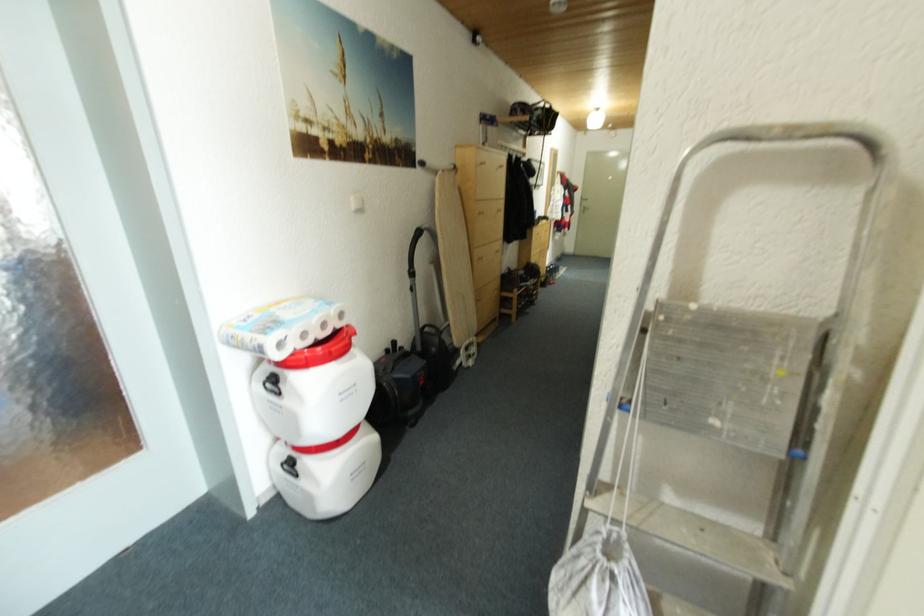
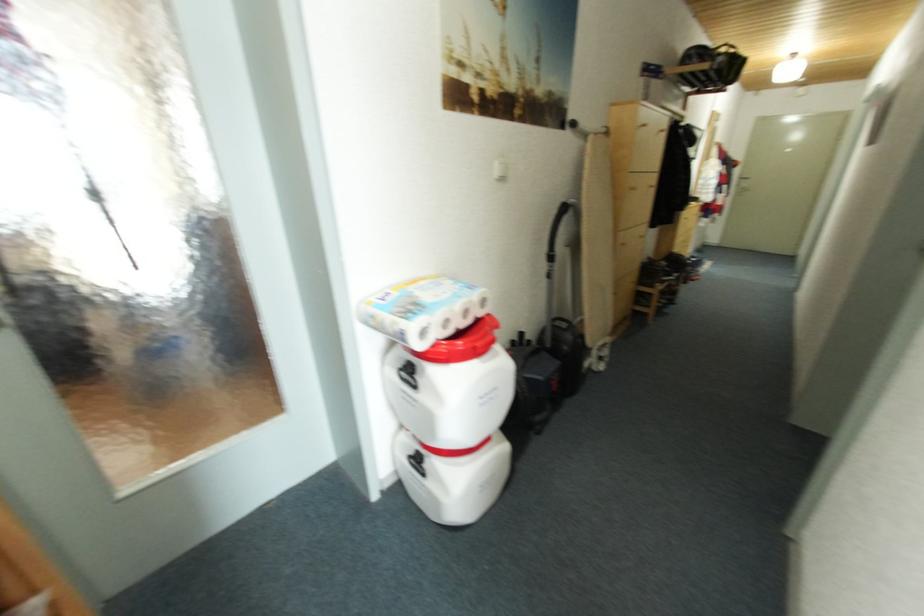
What movement of the cameraman would produce the second image?

The movement direction of the cameraman is left, forward.